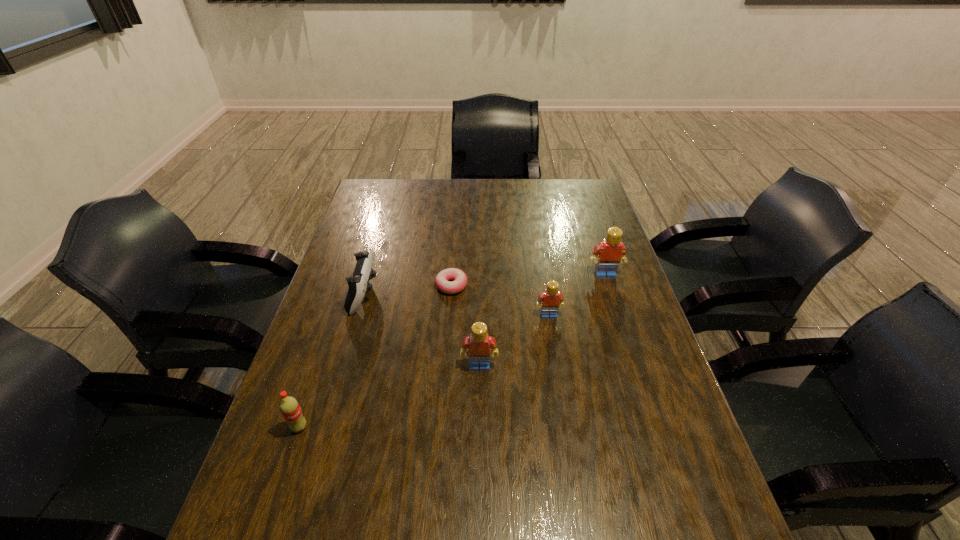
Where is `unoccupied position between the nearest object and the doughnut`? unoccupied position between the nearest object and the doughnut is located at coordinates (375, 356).

At what (x,y) coordinates should I click in order to perform the action: click on blank region between the leftmost object and the control. Please return your answer as a coordinate pair (x, y). Image resolution: width=960 pixels, height=540 pixels. Looking at the image, I should click on [x=331, y=361].

The width and height of the screenshot is (960, 540). Identify the location of free spot between the second nearest object and the second farthest Lego. (514, 341).

Locate an element on the screen. free space that is in between the control and the second nearest object is located at coordinates (421, 330).

Locate which object ranks fifth in proximity to the nearest Lego. Please provide its 2D coordinates. Your answer should be formatted as a tuple, i.e. [(x, y)], where the tuple contains the x and y coordinates of a point satisfying the conditions above.

[(611, 251)]

Point out which object is positioned as the fifth nearest to the fifth farthest object. Please provide its 2D coordinates. Your answer should be formatted as a tuple, i.e. [(x, y)], where the tuple contains the x and y coordinates of a point satisfying the conditions above.

[(611, 251)]

Choose which Lego is the nearest neighbor to the rightmost object. Please provide its 2D coordinates. Your answer should be formatted as a tuple, i.e. [(x, y)], where the tuple contains the x and y coordinates of a point satisfying the conditions above.

[(551, 299)]

This screenshot has height=540, width=960. I want to click on Lego that is the nearest to the shortest object, so click(x=551, y=299).

Where is `vacant area in the image that satisfies the following two spatial constraints: 1. on the front-facing side of the fifth object from right to left; 2. on the front side of the leftmost object`? Image resolution: width=960 pixels, height=540 pixels. vacant area in the image that satisfies the following two spatial constraints: 1. on the front-facing side of the fifth object from right to left; 2. on the front side of the leftmost object is located at coordinates (326, 427).

Identify the location of free space that satisfies the following two spatial constraints: 1. on the front-facing side of the rightmost object; 2. on the front-facing side of the control. (612, 295).